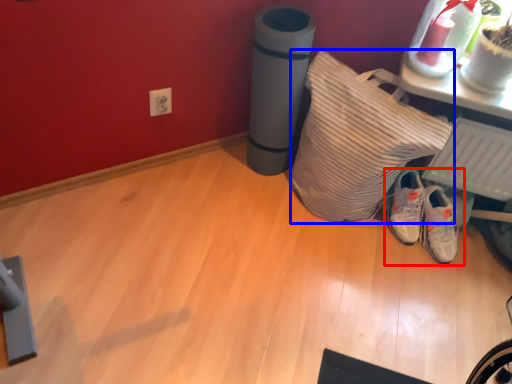
Question: Which object appears closest to the camera in this image, footwear (highlighted by a red box) or pillow (highlighted by a blue box)?

Choices:
 (A) footwear
 (B) pillow

Answer: (B)